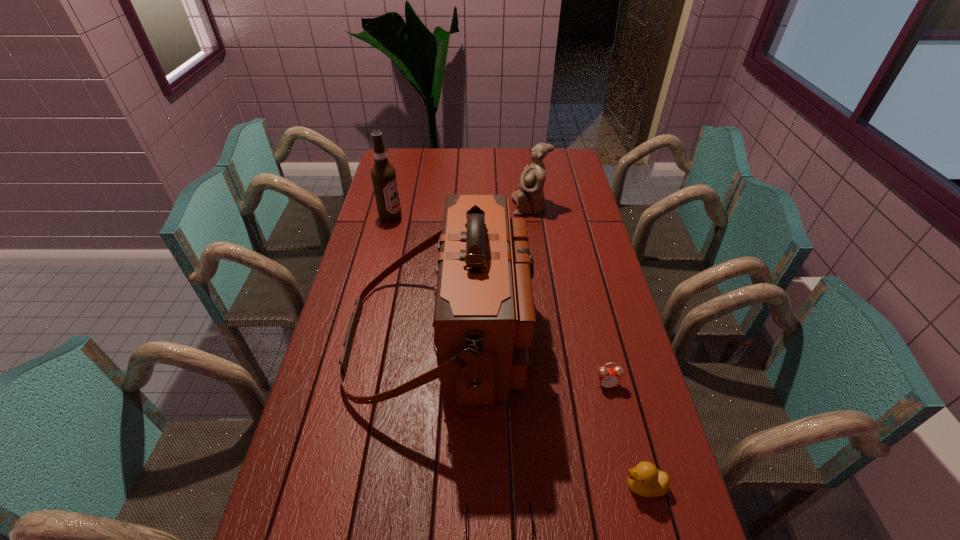
The height and width of the screenshot is (540, 960). What are the coordinates of `the tallest object` in the screenshot? It's located at (484, 314).

Where is `alcohol`? The height and width of the screenshot is (540, 960). alcohol is located at coordinates (383, 174).

Locate an element on the screen. figurine is located at coordinates (530, 199).

Find the location of a particular element. the fifth farthest object is located at coordinates point(645,479).

Locate an element on the screen. alarm clock is located at coordinates [x=608, y=377].

Image resolution: width=960 pixels, height=540 pixels. I want to click on free space located on the face side of the satchel, so click(575, 338).

The height and width of the screenshot is (540, 960). I want to click on free location located 0.290m on the label of the alcohol, so click(x=476, y=217).

I want to click on free space located on the front-facing side of the third tallest object, so click(x=479, y=206).

I want to click on vacant area located 0.360m on the front-facing side of the third tallest object, so click(x=421, y=206).

Find the location of a particular element. The height and width of the screenshot is (540, 960). vacant area located 0.400m on the front-facing side of the third tallest object is located at coordinates (412, 206).